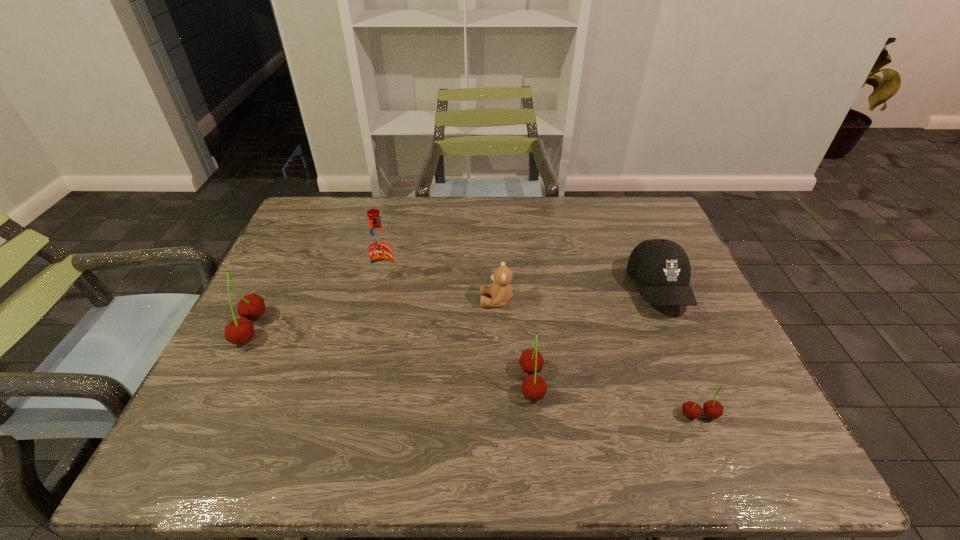
This screenshot has height=540, width=960. Find the location of `cherry that stands as the third closest to the baseball cap`. cherry that stands as the third closest to the baseball cap is located at coordinates (239, 331).

Locate which cherry is the third closest to the fifth object from right to left. Please provide its 2D coordinates. Your answer should be formatted as a tuple, i.e. [(x, y)], where the tuple contains the x and y coordinates of a point satisfying the conditions above.

[(713, 409)]